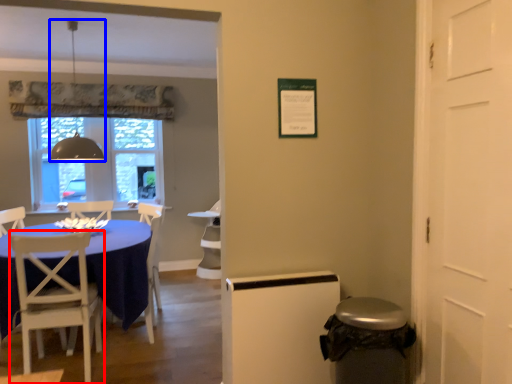
Question: Which object appears farthest to the camera in this image, chair (highlighted by a red box) or lamp (highlighted by a blue box)?

Choices:
 (A) chair
 (B) lamp

Answer: (B)